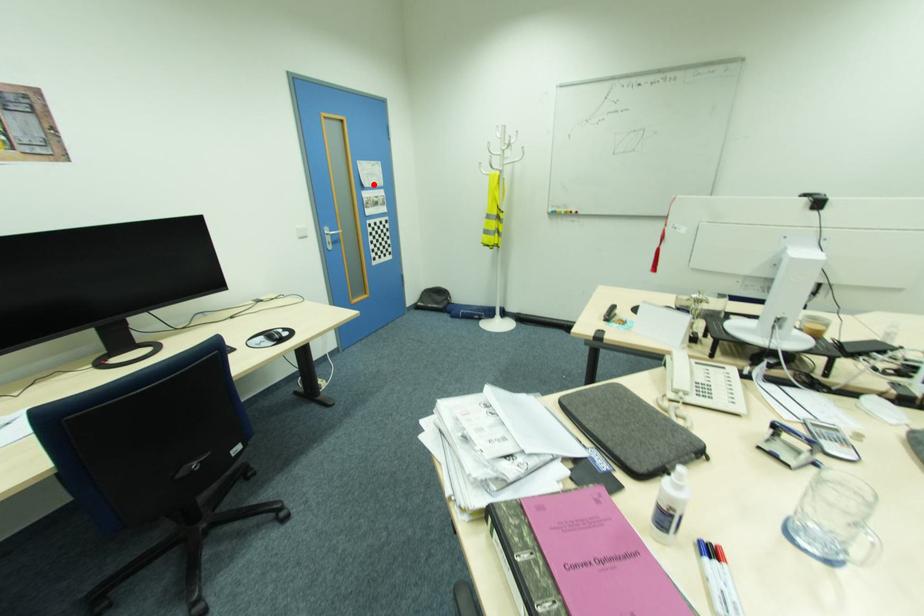
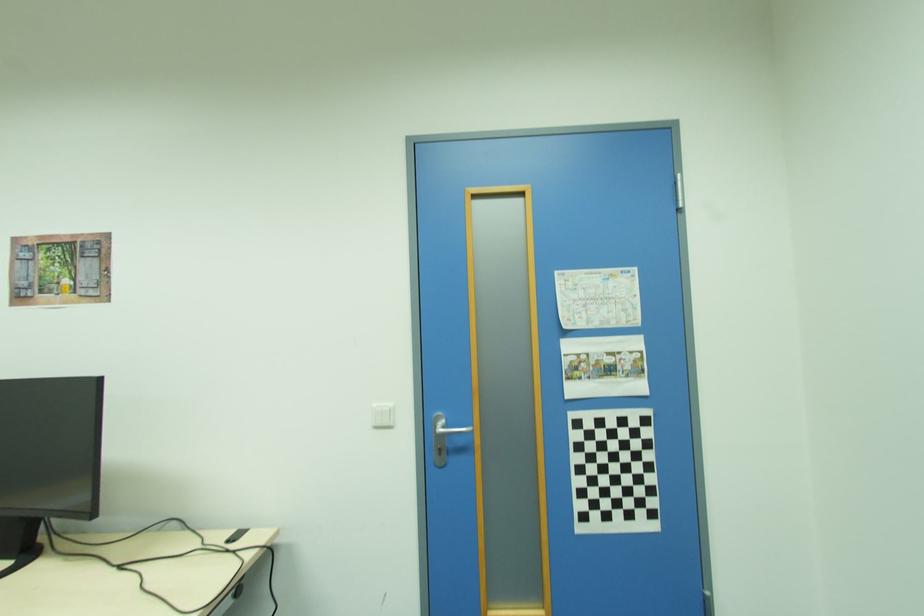
Find the pixel in the second image that matches the highlighted location in the first image.

(599, 325)